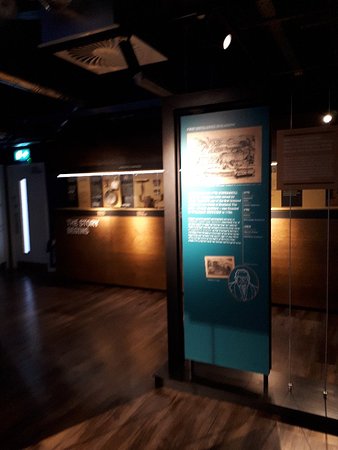
Where is `ceiling fan`? ceiling fan is located at coordinates (105, 53).